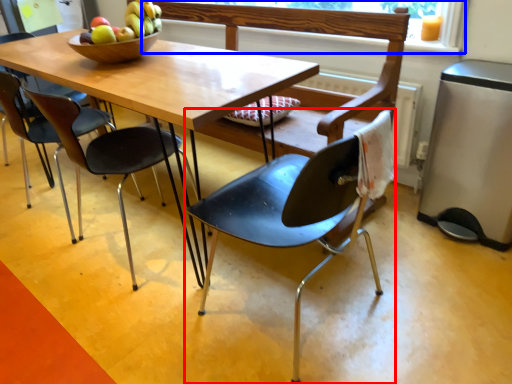
Question: Which point is closer to the camera, chair (highlighted by a red box) or window screen (highlighted by a blue box)?

Choices:
 (A) chair
 (B) window screen

Answer: (A)